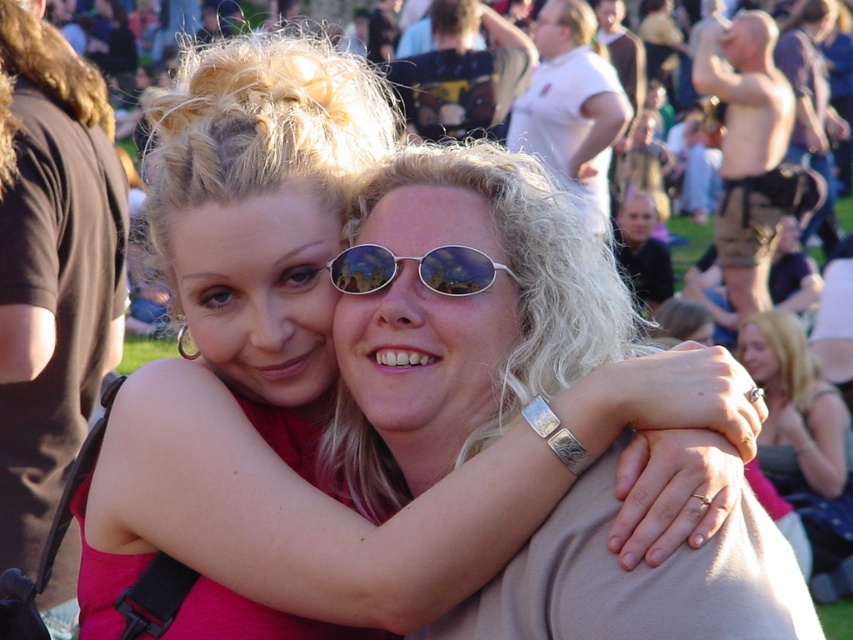
Question: Is the position of blonde hair at center less distant than that of sunglasses at center?

Choices:
 (A) no
 (B) yes

Answer: (A)

Question: Is blonde hair at center smaller than sunglasses at center?

Choices:
 (A) yes
 (B) no

Answer: (A)

Question: Observing the image, what is the correct spatial positioning of blonde hair at center in reference to sunglasses at center?

Choices:
 (A) left
 (B) right

Answer: (B)

Question: Which of the following is the farthest from the observer?

Choices:
 (A) (368, 248)
 (B) (805, 380)

Answer: (B)

Question: Which point appears farthest from the camera in this image?

Choices:
 (A) (831, 428)
 (B) (444, 244)

Answer: (A)

Question: Which point is closer to the camera taking this photo?

Choices:
 (A) (848, 493)
 (B) (380, 256)

Answer: (B)